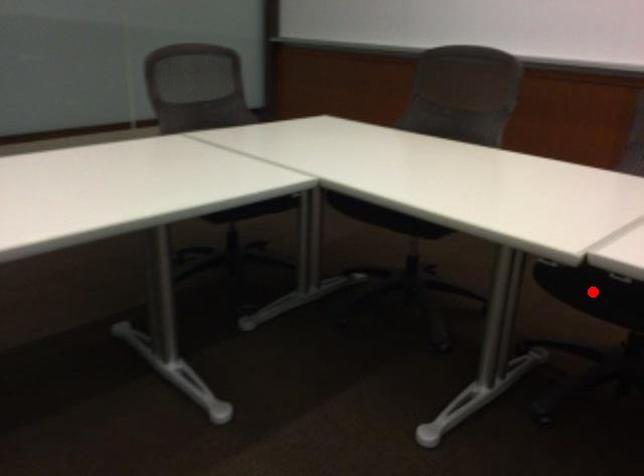
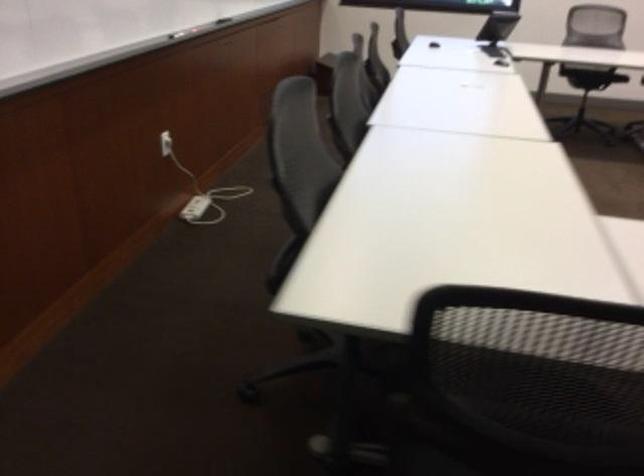
Question: I am providing you with two images of the same scene from different viewpoints. A red point is marked on the first image. At the location where the point appears in image 1, is it still visible in image 2?

Choices:
 (A) Yes
 (B) No

Answer: (B)